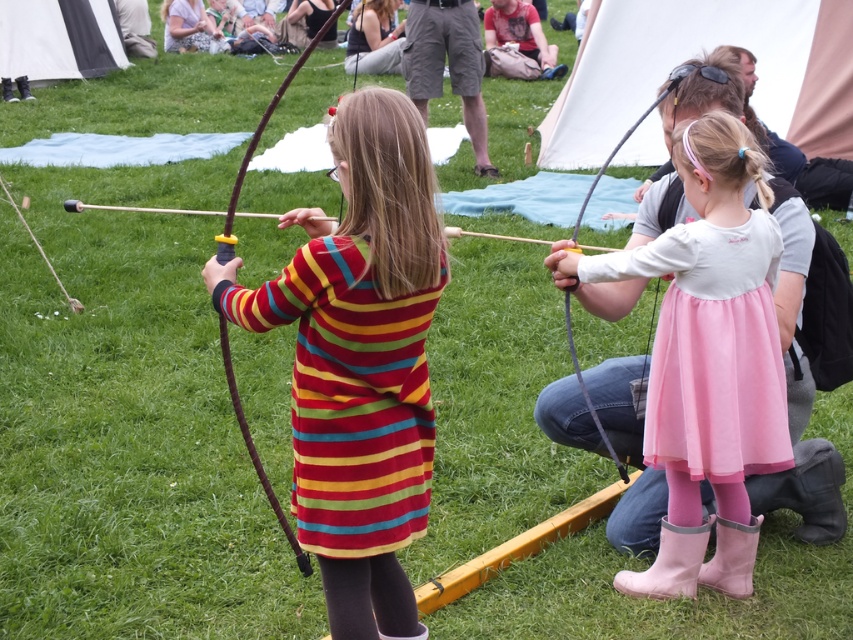
Consider the image. Can you confirm if striped fabric dress at center is positioned to the left of pink tulle dress at center?

Indeed, striped fabric dress at center is positioned on the left side of pink tulle dress at center.

Between striped fabric dress at center and pink tulle dress at center, which one appears on the right side from the viewer's perspective?

pink tulle dress at center is more to the right.

Describe the element at coordinates (358, 360) in the screenshot. Image resolution: width=853 pixels, height=640 pixels. I see `striped fabric dress at center` at that location.

What are the coordinates of `striped fabric dress at center` in the screenshot? It's located at (358, 360).

Does pink satin dress at center appear on the right side of pink tulle dress at center?

No, pink satin dress at center is not to the right of pink tulle dress at center.

Is point (747, 282) less distant than point (705, 458)?

Yes, point (747, 282) is closer to viewer.

The width and height of the screenshot is (853, 640). Find the location of `pink satin dress at center`. pink satin dress at center is located at coordinates (708, 360).

Is striped fabric dress at center further to camera compared to pink satin dress at center?

No.

The width and height of the screenshot is (853, 640). What are the coordinates of `striped fabric dress at center` in the screenshot? It's located at 358,360.